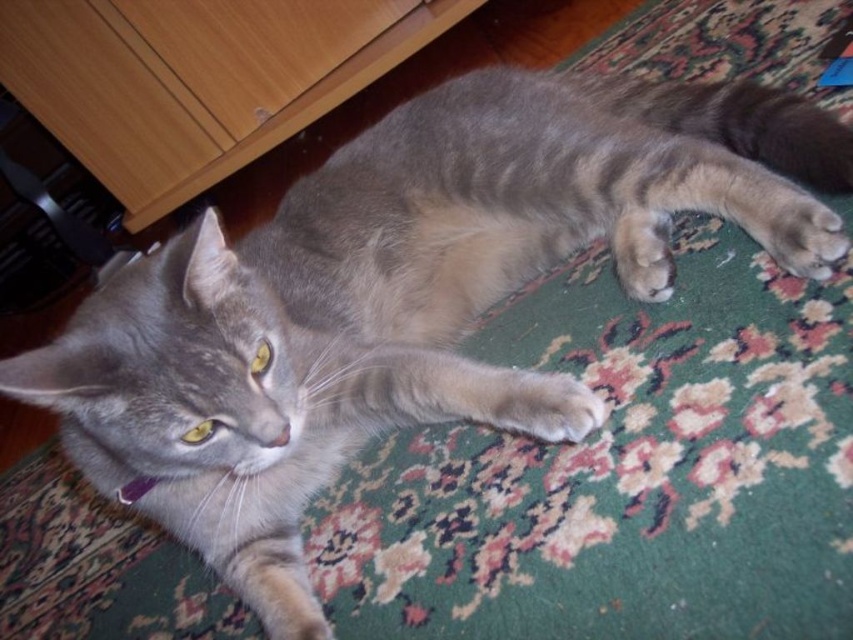
Question: Where is wooden dresser at upper left located in relation to soft fur paw at center in the image?

Choices:
 (A) right
 (B) left

Answer: (B)

Question: Which object appears closest to the camera in this image?

Choices:
 (A) wooden drawer at upper left
 (B) wooden dresser at upper left
 (C) gray fur paw at lower right
 (D) gray fur paw at center

Answer: (D)

Question: Among these points, which one is nearest to the camera?

Choices:
 (A) (364, 28)
 (B) (637, 228)
 (C) (793, 232)

Answer: (C)

Question: Is wooden dresser at upper left to the right of gray fur paw at lower right from the viewer's perspective?

Choices:
 (A) yes
 (B) no

Answer: (B)

Question: Does wooden dresser at upper left appear under gray fur paw at lower right?

Choices:
 (A) no
 (B) yes

Answer: (A)

Question: Estimate the real-world distances between objects in this image. Which object is closer to the wooden drawer at upper left?

Choices:
 (A) wooden dresser at upper left
 (B) gray fur paw at center
 (C) soft fur paw at center

Answer: (A)